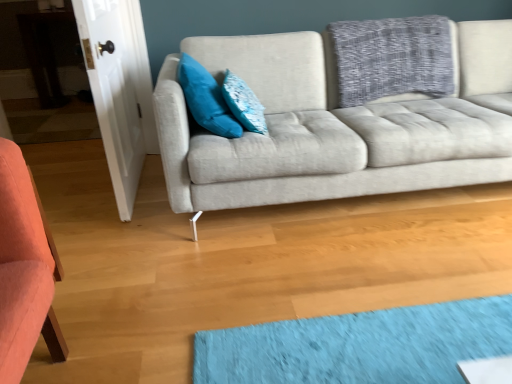
Consider the image. Measure the distance between point (x=117, y=195) and camera.

Point (x=117, y=195) is 6.45 feet away from camera.

The height and width of the screenshot is (384, 512). I want to click on white wood door at left, so click(x=119, y=89).

Describe the element at coordinates (336, 125) in the screenshot. I see `light gray fabric couch at center` at that location.

You are a GUI agent. You are given a task and a screenshot of the screen. Output one action in this format:
    pyautogui.click(x=<x>, y=<y>)
    Task: Click on the teal velvet pillow at upper left, the first pillow from the left
    Image resolution: width=512 pixels, height=384 pixels.
    Given the screenshot: What is the action you would take?
    pyautogui.click(x=206, y=99)

Choose the correct answer: Is textured blue pillow at center, the 2th pillow positioned from the left, inside white wood door at left or outside it?

textured blue pillow at center, the 2th pillow positioned from the left, is outside white wood door at left.

From a real-world perspective, between textured blue pillow at center, acting as the 1th pillow starting from the right, and white wood door at left, who is vertically higher?

From a 3D spatial view, textured blue pillow at center, acting as the 1th pillow starting from the right, is above.

Does textured blue pillow at center, acting as the 1th pillow starting from the right, touch white wood door at left?

No, textured blue pillow at center, acting as the 1th pillow starting from the right, is not in contact with white wood door at left.

Consider the image. Is textured blue pillow at center, the 2th pillow positioned from the left, to the right of white wood door at left from the viewer's perspective?

Yes.

Between light gray fabric couch at center and teal velvet pillow at upper left, the first pillow from the left, which one has smaller size?

teal velvet pillow at upper left, the first pillow from the left.

Which is closer to the camera, (327, 185) or (211, 119)?

Clearly, point (327, 185) is closer to the camera than point (211, 119).

Is teal velvet pillow at upper left, the first pillow from the left, at the back of light gray fabric couch at center?

light gray fabric couch at center is not turned away from teal velvet pillow at upper left, the first pillow from the left.

From a real-world perspective, is light gray fabric couch at center positioned above or below teal velvet pillow at upper left, the first pillow from the left?

From a real-world perspective, light gray fabric couch at center is physically below teal velvet pillow at upper left, the first pillow from the left.

Consider the image. Are teal velvet pillow at upper left, the first pillow from the left, and white wood door at left beside each other?

No, teal velvet pillow at upper left, the first pillow from the left, is not beside white wood door at left.

Is teal velvet pillow at upper left, the first pillow from the left, positioned before white wood door at left?

No, teal velvet pillow at upper left, the first pillow from the left, is further to the viewer.

Who is taller, teal velvet pillow at upper left, the first pillow from the left, or white wood door at left?

white wood door at left.

Which of these two, teal velvet pillow at upper left, placed as the second pillow when sorted from right to left, or white wood door at left, is wider?

Wider between the two is teal velvet pillow at upper left, placed as the second pillow when sorted from right to left.

Considering the sizes of teal velvet pillow at upper left, the first pillow from the left, and light gray fabric couch at center in the image, is teal velvet pillow at upper left, the first pillow from the left, wider or thinner than light gray fabric couch at center?

teal velvet pillow at upper left, the first pillow from the left, is thinner than light gray fabric couch at center.

From a real-world perspective, is teal velvet pillow at upper left, placed as the second pillow when sorted from right to left, positioned above or below light gray fabric couch at center?

teal velvet pillow at upper left, placed as the second pillow when sorted from right to left, is above light gray fabric couch at center.

Is point (206, 97) farther from viewer compared to point (276, 174)?

Yes, it is.

Which is more to the left, teal velvet pillow at upper left, placed as the second pillow when sorted from right to left, or light gray fabric couch at center?

From the viewer's perspective, teal velvet pillow at upper left, placed as the second pillow when sorted from right to left, appears more on the left side.

Which is more to the left, white wood door at left or teal velvet pillow at upper left, placed as the second pillow when sorted from right to left?

From the viewer's perspective, white wood door at left appears more on the left side.

Can you confirm if white wood door at left is wider than teal velvet pillow at upper left, the first pillow from the left?

In fact, white wood door at left might be narrower than teal velvet pillow at upper left, the first pillow from the left.

Between white wood door at left and teal velvet pillow at upper left, the first pillow from the left, which one is positioned in front?

Positioned in front is white wood door at left.

Is white wood door at left oriented towards teal velvet pillow at upper left, placed as the second pillow when sorted from right to left?

No, white wood door at left does not turn towards teal velvet pillow at upper left, placed as the second pillow when sorted from right to left.

Between white wood door at left and light gray fabric couch at center, which one appears on the left side from the viewer's perspective?

white wood door at left is more to the left.

Between white wood door at left and light gray fabric couch at center, which one has smaller size?

Smaller between the two is white wood door at left.

From a real-world perspective, is white wood door at left beneath light gray fabric couch at center?

No, from a real-world perspective, white wood door at left is not under light gray fabric couch at center.

Is point (125, 18) behind point (395, 168)?

Yes, point (125, 18) is farther from viewer.

Does light gray fabric couch at center come behind white wood door at left?

No, it is not.

The image size is (512, 384). Find the location of `studio couch that appears below the white wood door at left (from a real-world perspective)`. studio couch that appears below the white wood door at left (from a real-world perspective) is located at coordinates (336, 125).

From a real-world perspective, which object stands above the other?

From a 3D spatial view, white wood door at left is above.

What's the angular difference between light gray fabric couch at center and white wood door at left's facing directions?

The facing directions of light gray fabric couch at center and white wood door at left are 99.4 degrees apart.

I want to click on the 2nd pillow to the right of the white wood door at left, counting from the anchor's position, so click(x=244, y=104).

You are a GUI agent. You are given a task and a screenshot of the screen. Output one action in this format:
    pyautogui.click(x=<x>, y=<y>)
    Task: Click on the pillow that is the 1st object located behind the light gray fabric couch at center
    The width and height of the screenshot is (512, 384).
    Given the screenshot: What is the action you would take?
    pyautogui.click(x=206, y=99)

From the image, which object appears to be nearer to white wood door at left, textured blue pillow at center, the 2th pillow positioned from the left, or light gray fabric couch at center?

textured blue pillow at center, the 2th pillow positioned from the left, is positioned closer to the anchor white wood door at left.

Considering their positions, is light gray fabric couch at center positioned closer to teal velvet pillow at upper left, placed as the second pillow when sorted from right to left, than white wood door at left?

light gray fabric couch at center is positioned closer to the anchor teal velvet pillow at upper left, placed as the second pillow when sorted from right to left.

Based on their spatial positions, is light gray fabric couch at center or teal velvet pillow at upper left, the first pillow from the left, further from textured blue pillow at center, the 2th pillow positioned from the left?

The object further to textured blue pillow at center, the 2th pillow positioned from the left, is light gray fabric couch at center.

Looking at the image, which one is located closer to light gray fabric couch at center, white wood door at left or teal velvet pillow at upper left, placed as the second pillow when sorted from right to left?

Based on the image, teal velvet pillow at upper left, placed as the second pillow when sorted from right to left, appears to be nearer to light gray fabric couch at center.

When comparing their distances from white wood door at left, does textured blue pillow at center, the 2th pillow positioned from the left, or teal velvet pillow at upper left, the first pillow from the left, seem closer?

teal velvet pillow at upper left, the first pillow from the left.

Estimate the real-world distances between objects in this image. Which object is closer to teal velvet pillow at upper left, the first pillow from the left, light gray fabric couch at center or textured blue pillow at center, the 2th pillow positioned from the left?

Based on the image, textured blue pillow at center, the 2th pillow positioned from the left, appears to be nearer to teal velvet pillow at upper left, the first pillow from the left.

From the image, which object appears to be nearer to textured blue pillow at center, the 2th pillow positioned from the left, white wood door at left or teal velvet pillow at upper left, placed as the second pillow when sorted from right to left?

The object closer to textured blue pillow at center, the 2th pillow positioned from the left, is teal velvet pillow at upper left, placed as the second pillow when sorted from right to left.

Looking at the image, which one is located further to textured blue pillow at center, the 2th pillow positioned from the left, teal velvet pillow at upper left, the first pillow from the left, or light gray fabric couch at center?

light gray fabric couch at center is further to textured blue pillow at center, the 2th pillow positioned from the left.

Where is `pillow between teal velvet pillow at upper left, placed as the second pillow when sorted from right to left, and light gray fabric couch at center, in the horizontal direction`? Image resolution: width=512 pixels, height=384 pixels. pillow between teal velvet pillow at upper left, placed as the second pillow when sorted from right to left, and light gray fabric couch at center, in the horizontal direction is located at coordinates (244, 104).

I want to click on pillow between white wood door at left and textured blue pillow at center, the 2th pillow positioned from the left, in the horizontal direction, so click(x=206, y=99).